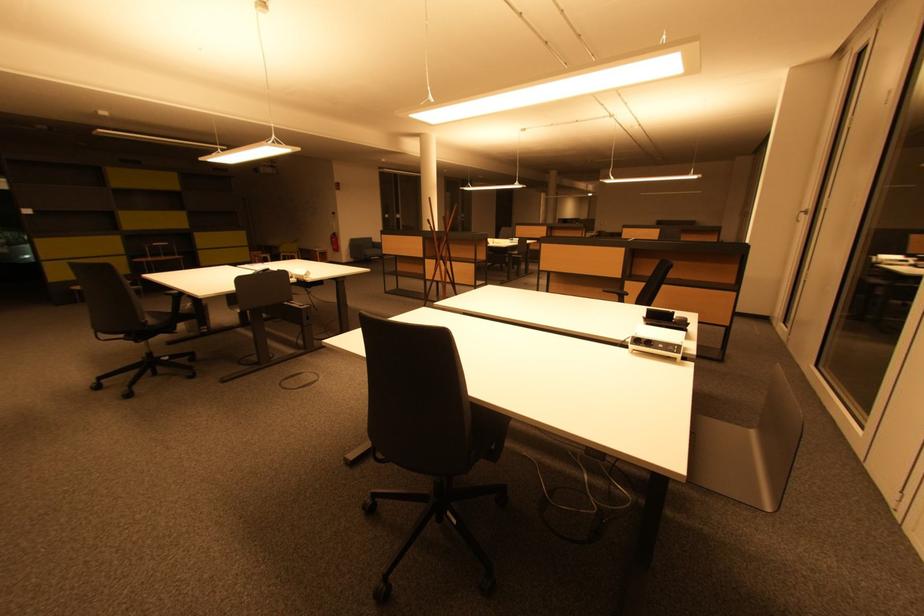
Find where to sit the black chair sitting surface. Please return your answer as a coordinate pair (x, y).

(146, 317)